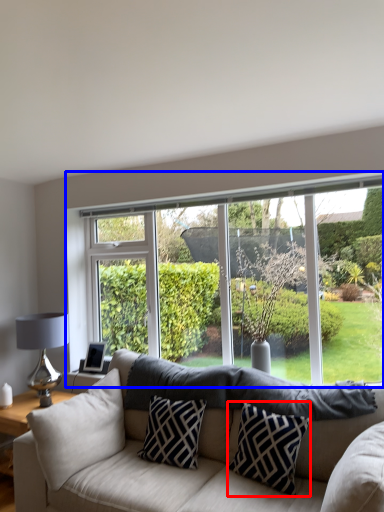
Question: Which object is closer to the camera taking this photo, pillow (highlighted by a red box) or window (highlighted by a blue box)?

Choices:
 (A) pillow
 (B) window

Answer: (A)